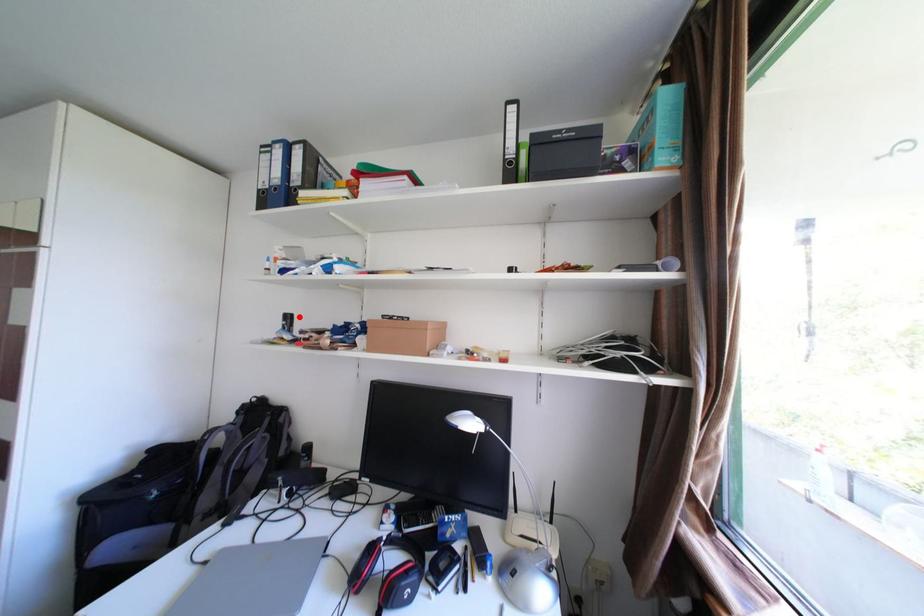
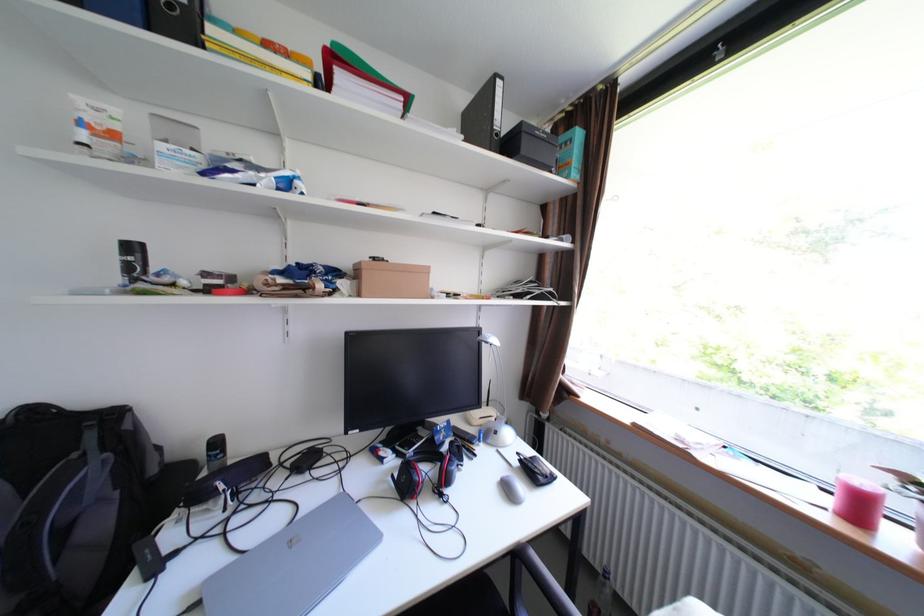
Find the pixel in the second image that matches the highlighted location in the first image.

(143, 248)